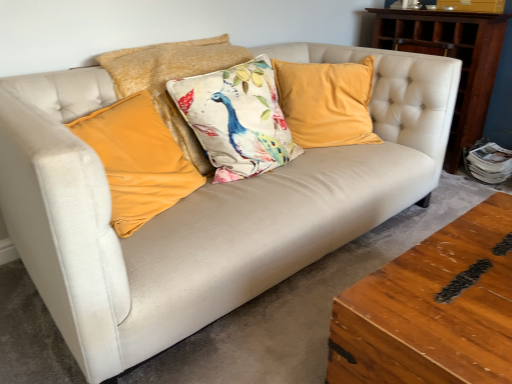
Identify the location of velvet peacock pillow at center, the 3th pillow when ordered from left to right. (237, 119).

What do you see at coordinates (137, 160) in the screenshot?
I see `velvet mustard pillow at left, placed as the first pillow when sorted from left to right` at bounding box center [137, 160].

Describe the element at coordinates (172, 79) in the screenshot. I see `velvet yellow pillow at center, which is the 3th pillow from right to left` at that location.

What are the coordinates of `wooden dresser at right` in the screenshot? It's located at (452, 57).

What is the approximate width of wooden dresser at right?

wooden dresser at right is 15.64 inches in width.

Identify the location of velvet peacock pillow at center, the 3th pillow when ordered from left to right. The image size is (512, 384). (237, 119).

Between point (497, 25) and point (410, 327), which one is positioned in front?

The point (410, 327) is more forward.

Would you say wooden dresser at right is inside or outside wooden coffee table at lower right?

wooden dresser at right is not enclosed by wooden coffee table at lower right.

From the image's perspective, between wooden dresser at right and wooden coffee table at lower right, which one is located above?

wooden dresser at right, from the image's perspective.

Considering the sizes of objects wooden dresser at right and wooden coffee table at lower right in the image provided, who is wider, wooden dresser at right or wooden coffee table at lower right?

wooden coffee table at lower right.

Does point (399, 34) lie behind point (90, 144)?

Yes, point (399, 34) is farther from viewer.

Is wooden dresser at right wider or thinner than velvet mustard pillow at left, the 4th pillow viewed from the right?

Considering their sizes, wooden dresser at right looks slimmer than velvet mustard pillow at left, the 4th pillow viewed from the right.

Consider the image. Which object is closer to the camera taking this photo, wooden dresser at right or velvet mustard pillow at left, placed as the first pillow when sorted from left to right?

velvet mustard pillow at left, placed as the first pillow when sorted from left to right, is in front.

Considering their positions, is velvet yellow pillow at center, the fourth pillow positioned from the left, located in front of or behind wooden coffee table at lower right?

velvet yellow pillow at center, the fourth pillow positioned from the left, is behind wooden coffee table at lower right.

Is velvet yellow pillow at center, the fourth pillow positioned from the left, to the left or to the right of wooden coffee table at lower right in the image?

Clearly, velvet yellow pillow at center, the fourth pillow positioned from the left, is on the left of wooden coffee table at lower right in the image.

From a real-world perspective, which object stands above the other?

velvet yellow pillow at center, the fourth pillow positioned from the left, is physically above.

Is velvet yellow pillow at center, which is counted as the first pillow, starting from the right, inside the boundaries of wooden coffee table at lower right, or outside?

The correct answer is: outside.

Between velvet mustard pillow at left, the 4th pillow viewed from the right, and velvet peacock pillow at center, which is counted as the 2th pillow, starting from the right, which one has smaller width?

velvet mustard pillow at left, the 4th pillow viewed from the right, is thinner.

Is point (146, 113) closer or farther from the camera than point (253, 137)?

Point (146, 113) is positioned closer to the camera compared to point (253, 137).

Between velvet mustard pillow at left, the 4th pillow viewed from the right, and velvet peacock pillow at center, the 3th pillow when ordered from left to right, which one has less height?

Standing shorter between the two is velvet mustard pillow at left, the 4th pillow viewed from the right.

Can you confirm if velvet mustard pillow at left, placed as the first pillow when sorted from left to right, is bigger than velvet peacock pillow at center, the 3th pillow when ordered from left to right?

Incorrect, velvet mustard pillow at left, placed as the first pillow when sorted from left to right, is not larger than velvet peacock pillow at center, the 3th pillow when ordered from left to right.

In the scene shown: Is velvet peacock pillow at center, the 3th pillow when ordered from left to right, touching velvet mustard pillow at left, placed as the first pillow when sorted from left to right?

A: They are not placed beside each other.

In the scene shown: Is velvet mustard pillow at left, the 4th pillow viewed from the right, at the back of velvet peacock pillow at center, which is counted as the 2th pillow, starting from the right?

velvet peacock pillow at center, which is counted as the 2th pillow, starting from the right, does not have its back to velvet mustard pillow at left, the 4th pillow viewed from the right.

Between velvet peacock pillow at center, which is counted as the 2th pillow, starting from the right, and velvet mustard pillow at left, the 4th pillow viewed from the right, which one is positioned behind?

velvet peacock pillow at center, which is counted as the 2th pillow, starting from the right, is more distant.

How many degrees apart are the facing directions of velvet peacock pillow at center, the 3th pillow when ordered from left to right, and velvet mustard pillow at left, placed as the first pillow when sorted from left to right?

velvet peacock pillow at center, the 3th pillow when ordered from left to right, and velvet mustard pillow at left, placed as the first pillow when sorted from left to right, are facing 14.2 degrees away from each other.

Can we say wooden dresser at right lies outside velvet yellow pillow at center, the fourth pillow positioned from the left?

wooden dresser at right is positioned outside velvet yellow pillow at center, the fourth pillow positioned from the left.

Which is more to the right, wooden dresser at right or velvet yellow pillow at center, which is counted as the first pillow, starting from the right?

wooden dresser at right.

From the image's perspective, does wooden dresser at right appear lower than velvet yellow pillow at center, the fourth pillow positioned from the left?

Incorrect, from the image's perspective, wooden dresser at right is higher than velvet yellow pillow at center, the fourth pillow positioned from the left.

From the image's perspective, is wooden coffee table at lower right located above velvet peacock pillow at center, the 3th pillow when ordered from left to right?

Incorrect, from the image's perspective, wooden coffee table at lower right is lower than velvet peacock pillow at center, the 3th pillow when ordered from left to right.

Are wooden coffee table at lower right and velvet peacock pillow at center, the 3th pillow when ordered from left to right, beside each other?

No, wooden coffee table at lower right is not beside velvet peacock pillow at center, the 3th pillow when ordered from left to right.

Does point (388, 287) come in front of point (227, 95)?

Yes.

How different are the orientations of wooden coffee table at lower right and velvet peacock pillow at center, which is counted as the 2th pillow, starting from the right, in degrees?

The facing directions of wooden coffee table at lower right and velvet peacock pillow at center, which is counted as the 2th pillow, starting from the right, are 91.6 degrees apart.

Where is `dresser to the right of wooden coffee table at lower right`? This screenshot has width=512, height=384. dresser to the right of wooden coffee table at lower right is located at coordinates pos(452,57).

Locate an element on the screen. The image size is (512, 384). dresser behind the velvet mustard pillow at left, placed as the first pillow when sorted from left to right is located at coordinates (452, 57).

Considering their positions, is velvet peacock pillow at center, the 3th pillow when ordered from left to right, positioned closer to velvet yellow pillow at center, which is counted as the first pillow, starting from the right, than wooden coffee table at lower right?

Among the two, velvet peacock pillow at center, the 3th pillow when ordered from left to right, is located nearer to velvet yellow pillow at center, which is counted as the first pillow, starting from the right.

When comparing their distances from velvet mustard pillow at left, placed as the first pillow when sorted from left to right, does wooden coffee table at lower right or velvet peacock pillow at center, the 3th pillow when ordered from left to right, seem closer?

The object closer to velvet mustard pillow at left, placed as the first pillow when sorted from left to right, is velvet peacock pillow at center, the 3th pillow when ordered from left to right.

From the image, which object appears to be farther from velvet yellow pillow at center, which is the 3th pillow from right to left, velvet mustard pillow at left, the 4th pillow viewed from the right, or velvet yellow pillow at center, which is counted as the first pillow, starting from the right?

The object further to velvet yellow pillow at center, which is the 3th pillow from right to left, is velvet yellow pillow at center, which is counted as the first pillow, starting from the right.

When comparing their distances from wooden dresser at right, does velvet yellow pillow at center, positioned as the second pillow in left-to-right order, or wooden coffee table at lower right seem closer?

The object closer to wooden dresser at right is velvet yellow pillow at center, positioned as the second pillow in left-to-right order.

Estimate the real-world distances between objects in this image. Which object is closer to velvet mustard pillow at left, placed as the first pillow when sorted from left to right, velvet peacock pillow at center, the 3th pillow when ordered from left to right, or velvet yellow pillow at center, the fourth pillow positioned from the left?

The object closer to velvet mustard pillow at left, placed as the first pillow when sorted from left to right, is velvet peacock pillow at center, the 3th pillow when ordered from left to right.

From the image, which object appears to be farther from velvet yellow pillow at center, the fourth pillow positioned from the left, wooden coffee table at lower right or velvet mustard pillow at left, placed as the first pillow when sorted from left to right?

Based on the image, wooden coffee table at lower right appears to be further to velvet yellow pillow at center, the fourth pillow positioned from the left.

When comparing their distances from velvet mustard pillow at left, the 4th pillow viewed from the right, does velvet yellow pillow at center, positioned as the second pillow in left-to-right order, or velvet yellow pillow at center, the fourth pillow positioned from the left, seem further?

Among the two, velvet yellow pillow at center, the fourth pillow positioned from the left, is located further to velvet mustard pillow at left, the 4th pillow viewed from the right.

Estimate the real-world distances between objects in this image. Which object is further from velvet peacock pillow at center, which is counted as the 2th pillow, starting from the right, wooden dresser at right or velvet mustard pillow at left, placed as the first pillow when sorted from left to right?

wooden dresser at right.

Locate an element on the screen. pillow between velvet yellow pillow at center, which is the 3th pillow from right to left, and velvet yellow pillow at center, which is counted as the first pillow, starting from the right, from left to right is located at coordinates (237, 119).

The image size is (512, 384). I want to click on pillow between velvet mustard pillow at left, the 4th pillow viewed from the right, and velvet peacock pillow at center, which is counted as the 2th pillow, starting from the right, so click(x=172, y=79).

At what (x,y) coordinates should I click in order to perform the action: click on table between velvet mustard pillow at left, placed as the first pillow when sorted from left to right, and wooden dresser at right from left to right. Please return your answer as a coordinate pair (x, y). This screenshot has width=512, height=384. Looking at the image, I should click on (432, 309).

I want to click on pillow between velvet peacock pillow at center, the 3th pillow when ordered from left to right, and wooden dresser at right from left to right, so click(x=326, y=102).